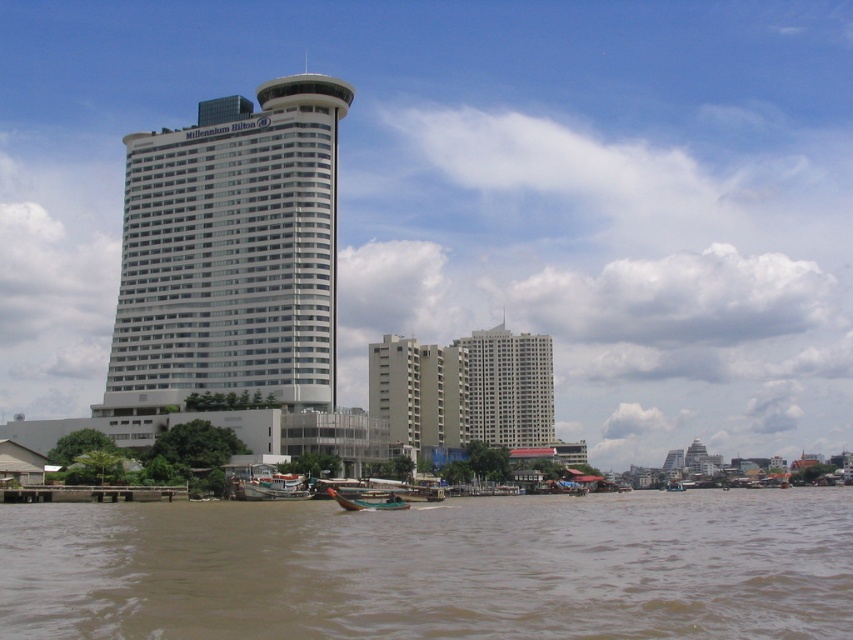
Who is positioned more to the left, brown muddy water at lower center or white smooth building at center?

From the viewer's perspective, brown muddy water at lower center appears more on the left side.

Describe the element at coordinates (434, 568) in the screenshot. The image size is (853, 640). I see `brown muddy water at lower center` at that location.

Identify the location of brown muddy water at lower center. The height and width of the screenshot is (640, 853). (434, 568).

Which is below, brown muddy water at lower center or white glass building at center?

Positioned lower is brown muddy water at lower center.

Who is more distant from viewer, (393, 541) or (166, 292)?

Point (166, 292)

What are the coordinates of `brown muddy water at lower center` in the screenshot? It's located at (434, 568).

Can you confirm if white glass building at center is positioned above white plastic boat at lower center?

Correct, white glass building at center is located above white plastic boat at lower center.

Can you confirm if white glass building at center is shorter than white plastic boat at lower center?

No, white glass building at center is not shorter than white plastic boat at lower center.

The image size is (853, 640). What do you see at coordinates (230, 253) in the screenshot? I see `white glass building at center` at bounding box center [230, 253].

At what (x,y) coordinates should I click in order to perform the action: click on white glass building at center. Please return your answer as a coordinate pair (x, y). The height and width of the screenshot is (640, 853). Looking at the image, I should click on (230, 253).